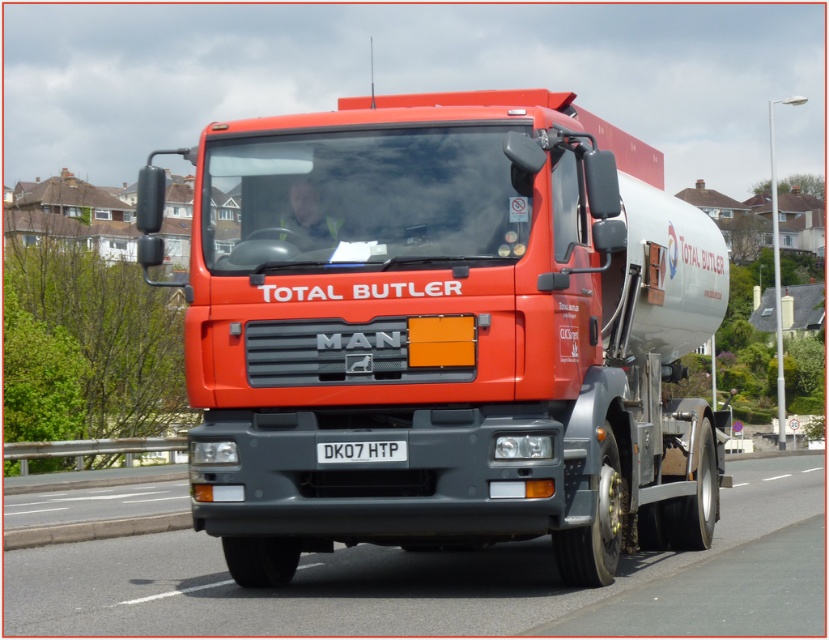
Question: Which of these objects is positioned closest to the black rubber highway at center?

Choices:
 (A) white plastic license plate at center
 (B) metallic red trailer truck at center

Answer: (B)

Question: Does metallic red trailer truck at center appear on the left side of black rubber highway at center?

Choices:
 (A) yes
 (B) no

Answer: (A)

Question: Which point is farther to the camera?

Choices:
 (A) (100, 604)
 (B) (285, 308)

Answer: (A)

Question: Does black rubber highway at center appear under white plastic license plate at center?

Choices:
 (A) no
 (B) yes

Answer: (B)

Question: Which of the following is the closest to the observer?

Choices:
 (A) white plastic license plate at center
 (B) black rubber highway at center

Answer: (B)

Question: Does metallic red trailer truck at center lie behind black rubber highway at center?

Choices:
 (A) no
 (B) yes

Answer: (B)